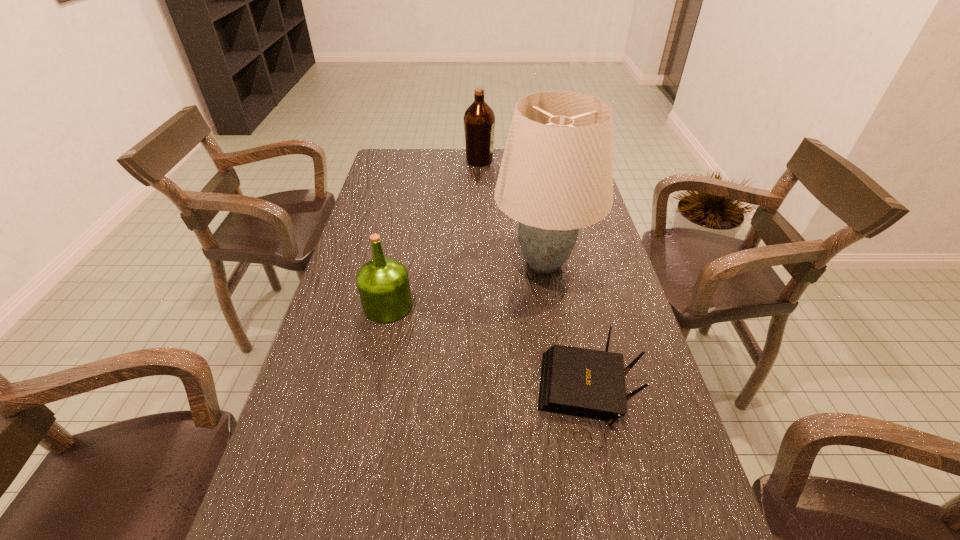
Locate an element on the screen. The image size is (960, 540). vacant area situated 0.050m on the back of the router is located at coordinates (575, 334).

The image size is (960, 540). Identify the location of object that is at the far edge. (479, 120).

The image size is (960, 540). Identify the location of object at the left edge. (383, 284).

The width and height of the screenshot is (960, 540). In order to click on lampshade at the right edge in this screenshot , I will do `click(556, 176)`.

The height and width of the screenshot is (540, 960). I want to click on router at the right edge, so click(587, 383).

Locate an element on the screen. vacant point at the left edge is located at coordinates (359, 431).

Where is `free space at the right edge`? Image resolution: width=960 pixels, height=540 pixels. free space at the right edge is located at coordinates (569, 263).

Where is `free space between the nearer olive oil and the shortest object`? Image resolution: width=960 pixels, height=540 pixels. free space between the nearer olive oil and the shortest object is located at coordinates (488, 348).

This screenshot has width=960, height=540. What are the coordinates of `empty space that is in between the shortest object and the left olive oil` in the screenshot? It's located at coord(488,348).

The width and height of the screenshot is (960, 540). Find the location of `free spot between the leftmost object and the nearest object`. free spot between the leftmost object and the nearest object is located at coordinates (488, 348).